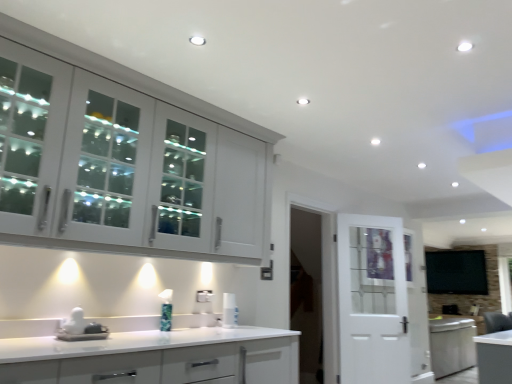
Question: Should I look upward or downward to see white glossy countertop at lower center, the first cabinetry from the bottom?

Choices:
 (A) up
 (B) down

Answer: (B)

Question: From a real-world perspective, does white glossy spray can at center stand above white glossy sink at lower left?

Choices:
 (A) no
 (B) yes

Answer: (B)

Question: From a real-world perspective, is white glossy spray can at center under white glossy sink at lower left?

Choices:
 (A) yes
 (B) no

Answer: (B)

Question: Would you say white glossy spray can at center is outside white glossy sink at lower left?

Choices:
 (A) no
 (B) yes

Answer: (B)

Question: Would you say white glossy sink at lower left is part of white glossy spray can at center's contents?

Choices:
 (A) yes
 (B) no

Answer: (B)

Question: Is white glossy spray can at center to the right of white glossy sink at lower left from the viewer's perspective?

Choices:
 (A) yes
 (B) no

Answer: (A)

Question: Considering the relative sizes of white glossy spray can at center and white glossy sink at lower left in the image provided, is white glossy spray can at center bigger than white glossy sink at lower left?

Choices:
 (A) yes
 (B) no

Answer: (B)

Question: From a real-world perspective, is white glossy countertop at lower center, the first cabinetry from the bottom, on top of white glossy spray can at center?

Choices:
 (A) no
 (B) yes

Answer: (A)

Question: Can we say white glossy countertop at lower center, the first cabinetry from the bottom, lies outside white glossy spray can at center?

Choices:
 (A) no
 (B) yes

Answer: (B)

Question: Does white glossy countertop at lower center, the first cabinetry from the bottom, come in front of white glossy spray can at center?

Choices:
 (A) no
 (B) yes

Answer: (B)

Question: Are white glossy countertop at lower center, the first cabinetry from the bottom, and white glossy spray can at center beside each other?

Choices:
 (A) yes
 (B) no

Answer: (B)

Question: Could you tell me if white glossy countertop at lower center, which is the 2th cabinetry in top-to-bottom order, is facing white glossy spray can at center?

Choices:
 (A) yes
 (B) no

Answer: (B)

Question: Does white glossy countertop at lower center, the first cabinetry from the bottom, have a larger size compared to white glossy spray can at center?

Choices:
 (A) no
 (B) yes

Answer: (B)

Question: Can white glossy cabinet at upper left, the 2th cabinetry positioned from the bottom, be found inside white glossy countertop at lower center, the first cabinetry from the bottom?

Choices:
 (A) yes
 (B) no

Answer: (B)